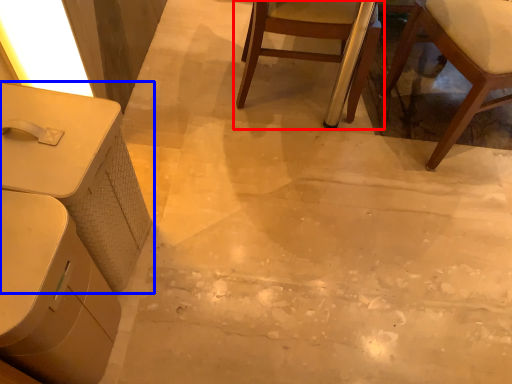
Question: Which of the following is the farthest to the observer, chair (highlighted by a red box) or table (highlighted by a blue box)?

Choices:
 (A) chair
 (B) table

Answer: (A)